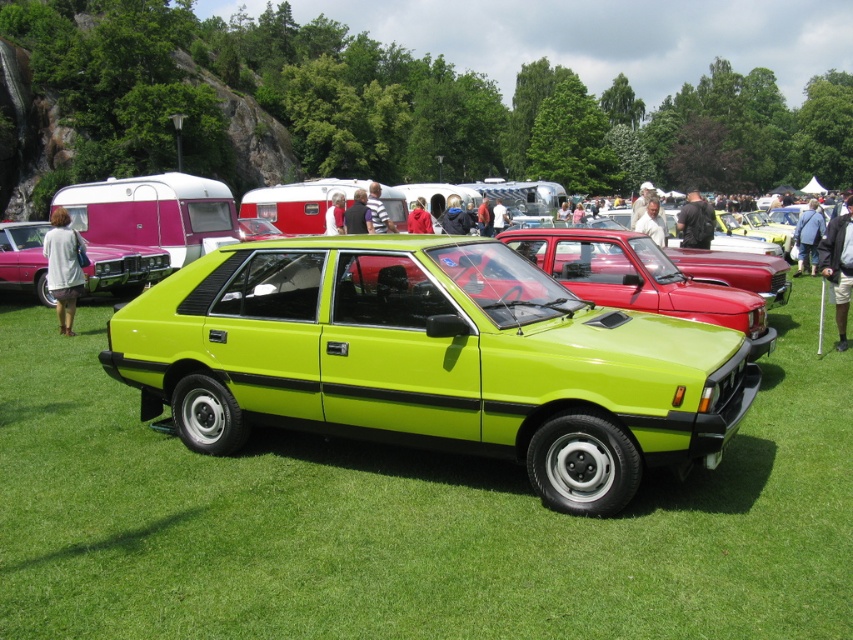
Question: Which of the following is the farthest from the observer?

Choices:
 (A) matte pink car at left
 (B) lime green plastic car at center

Answer: (A)

Question: Considering the relative positions of lime green plastic car at center and matte pink car at left in the image provided, where is lime green plastic car at center located with respect to matte pink car at left?

Choices:
 (A) left
 (B) right

Answer: (B)

Question: Does lime green plastic car at center have a smaller size compared to matte pink car at left?

Choices:
 (A) no
 (B) yes

Answer: (A)

Question: Is lime green plastic car at center further to the viewer compared to matte pink car at left?

Choices:
 (A) yes
 (B) no

Answer: (B)